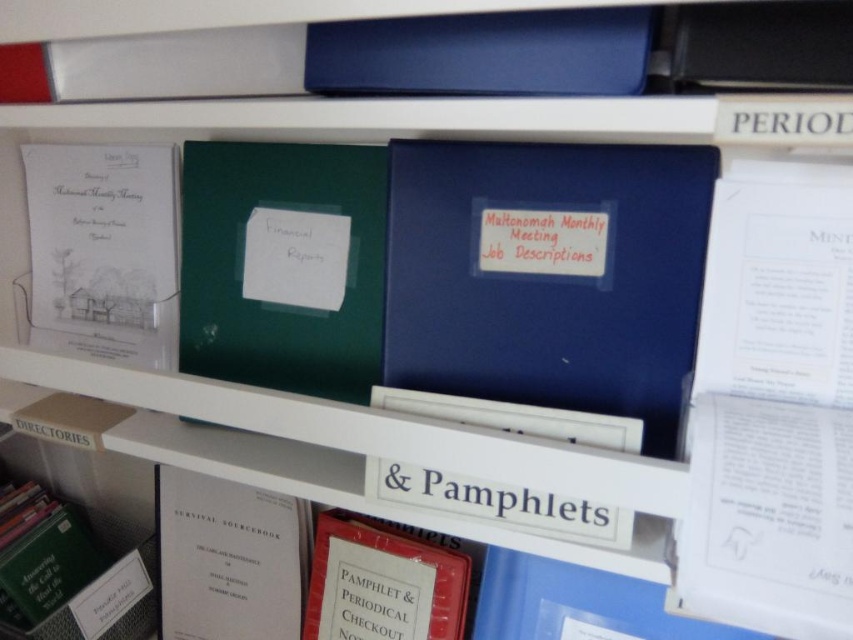
Question: Which of the following is the closest to the observer?

Choices:
 (A) white paper at center
 (B) matte red book at center

Answer: (A)

Question: Considering the real-world distances, which object is farthest from the green matte folder at center?

Choices:
 (A) white paper book at center
 (B) blue matte folder at center
 (C) white paper at center
 (D) white paper drawing at left

Answer: (A)

Question: Does blue matte folder at center appear under white paper at center?

Choices:
 (A) no
 (B) yes

Answer: (B)

Question: Is white paper drawing at left in front of white paper book at center?

Choices:
 (A) no
 (B) yes

Answer: (B)

Question: Which object is closer to the camera taking this photo?

Choices:
 (A) green matte folder at center
 (B) matte red book at center

Answer: (A)

Question: Is matte red book at center to the left of white paper at center from the viewer's perspective?

Choices:
 (A) no
 (B) yes

Answer: (A)